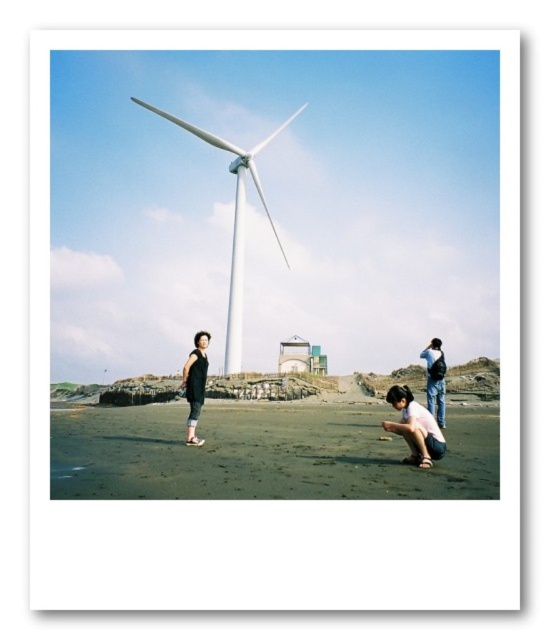
Question: Is dark sand at lower center thinner than matte black backpack at lower right?

Choices:
 (A) yes
 (B) no

Answer: (B)

Question: Estimate the real-world distances between objects in this image. Which object is closer to the light pink fabric at lower center?

Choices:
 (A) dark sand at lower center
 (B) matte black backpack at lower right
 (C) dark gray fabric dress at lower center
 (D) white matte wind turbine at center

Answer: (B)

Question: Considering the relative positions of white matte wind turbine at center and light pink fabric at lower center in the image provided, where is white matte wind turbine at center located with respect to light pink fabric at lower center?

Choices:
 (A) left
 (B) right

Answer: (A)

Question: Does light pink fabric at lower center have a larger size compared to dark gray fabric dress at lower center?

Choices:
 (A) yes
 (B) no

Answer: (B)

Question: Which point is closer to the camera?

Choices:
 (A) (442, 396)
 (B) (201, 364)
 (C) (100, 440)

Answer: (C)

Question: Which point is farther to the camera?

Choices:
 (A) (470, 486)
 (B) (231, 307)
 (C) (195, 387)

Answer: (B)